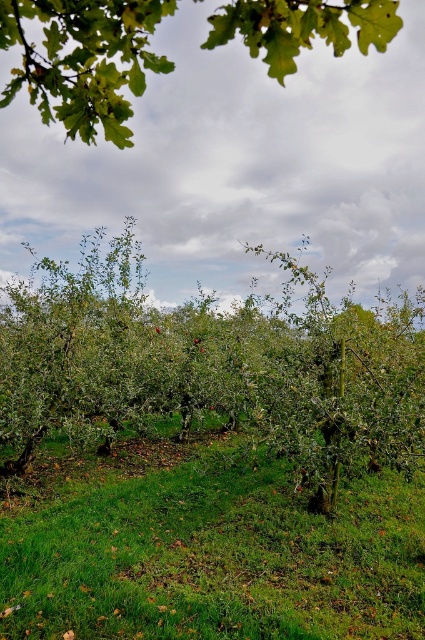
Is point (47, 512) closer to viewer compared to point (278, 13)?

That is False.

Is point (189, 598) positioned behind point (320, 17)?

That is True.

Measure the distance between green grassy at center and camera.

4.27 meters

You are a GUI agent. You are given a task and a screenshot of the screen. Output one action in this format:
    pyautogui.click(x=<x>, y=<y>)
    Task: Click on the green grassy at center
    The width and height of the screenshot is (425, 640).
    Given the screenshot: What is the action you would take?
    [207, 552]

Which is behind, point (320, 586) or point (67, 408)?

The point (67, 408) is behind.

Is point (50, 596) more distant than point (102, 374)?

That is False.

Is point (161, 454) less distant than point (283, 352)?

No, (161, 454) is behind (283, 352).

Find the location of a particular element. Image resolution: width=425 pixels, height=640 pixels. green grassy at center is located at coordinates (207, 552).

Consider the image. Can you confirm if green leafy tree at center is positioned below green leafy branch at upper center?

Yes, green leafy tree at center is below green leafy branch at upper center.

Can you confirm if green leafy tree at center is wider than green leafy branch at upper center?

In fact, green leafy tree at center might be narrower than green leafy branch at upper center.

Is point (328, 337) more distant than point (295, 40)?

Yes.

Where is `green leafy tree at center`? green leafy tree at center is located at coordinates (209, 365).